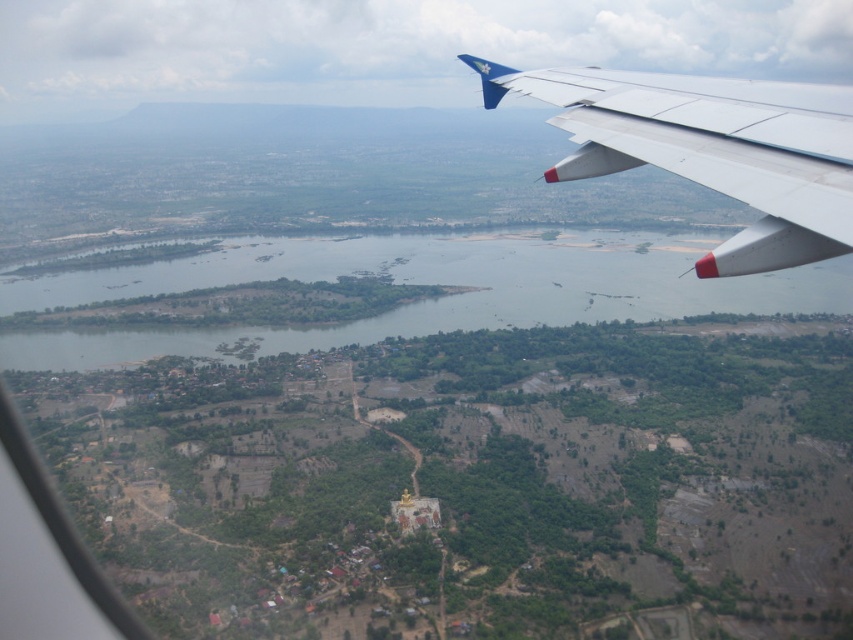
Which is in front, point (618, 285) or point (833, 240)?

Point (833, 240)

The width and height of the screenshot is (853, 640). What do you see at coordinates (419, 284) in the screenshot? I see `green grassy land at center` at bounding box center [419, 284].

Locate an element on the screen. green grassy land at center is located at coordinates (419, 284).